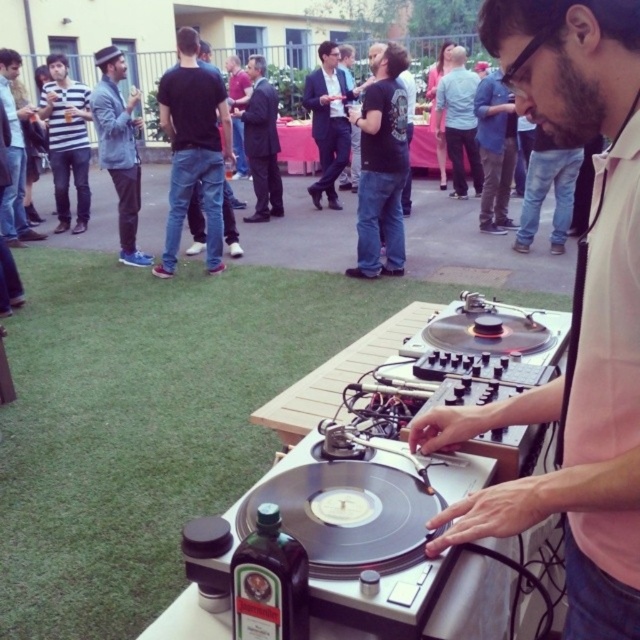
Question: Which point appears closest to the camera in this image?

Choices:
 (A) (131, 234)
 (B) (483, 131)

Answer: (A)

Question: Does denim jacket at upper left appear over dark suit jacket at center?

Choices:
 (A) yes
 (B) no

Answer: (B)

Question: Which is nearer to the white plastic table at center?

Choices:
 (A) denim jacket at upper left
 (B) black matte shirt at upper center

Answer: (B)

Question: Which point is closer to the camera?

Choices:
 (A) (186, 36)
 (B) (493, 186)
 (C) (253, 74)
 (D) (68, 147)

Answer: (A)

Question: Can you confirm if pink matte shirt at center is wider than denim jacket at upper left?

Choices:
 (A) no
 (B) yes

Answer: (A)

Question: Can you confirm if black matte shirt at upper center is wider than pink shirt at center?

Choices:
 (A) no
 (B) yes

Answer: (B)